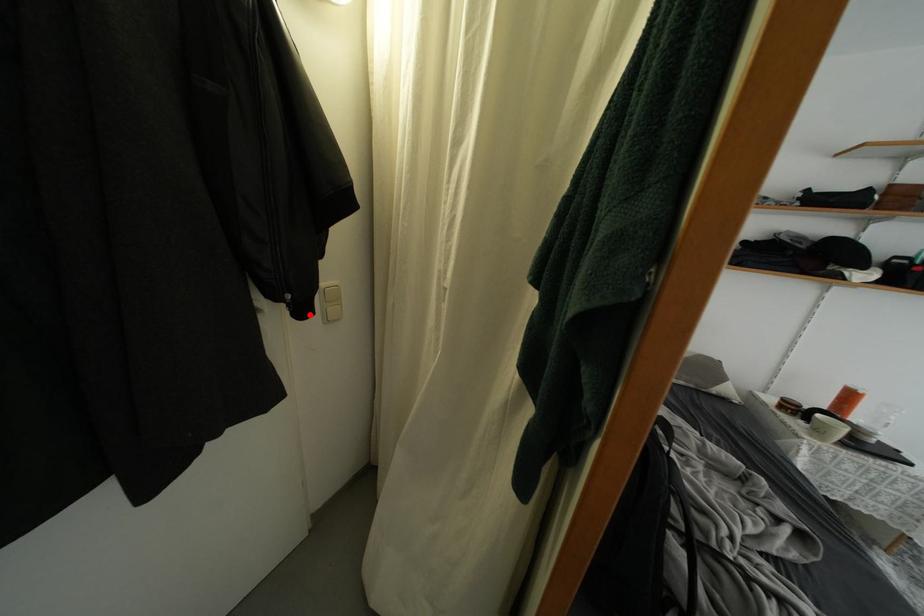
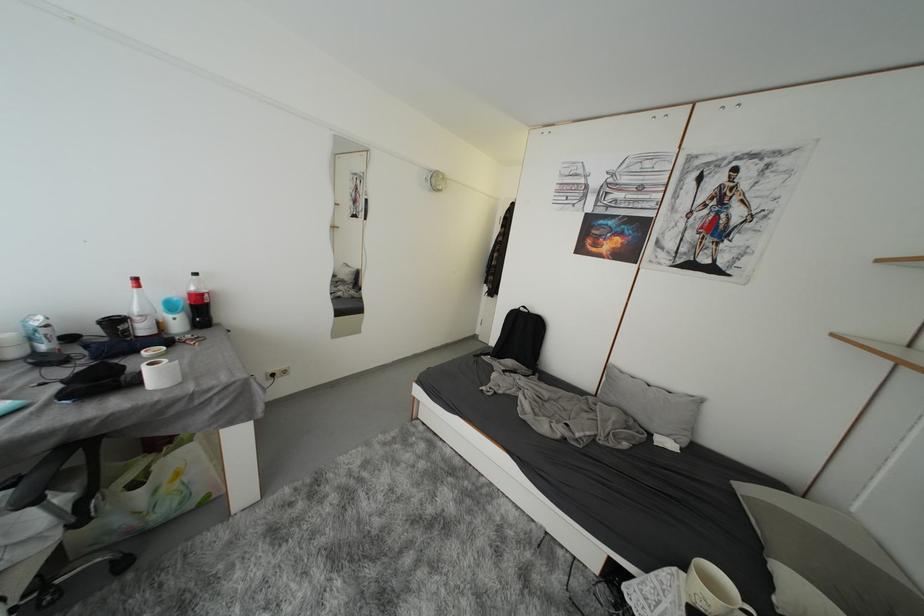
Question: I am providing you with two images of the same scene from different viewpoints. A red point is marked on the first image. Is the red point's position out of view in image 2?

Choices:
 (A) Yes
 (B) No

Answer: (A)